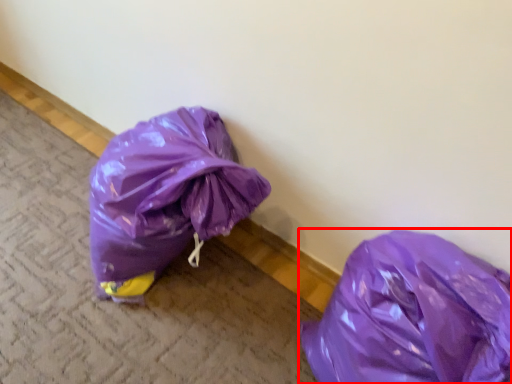
Question: Considering the relative positions of plastic bag (annotated by the red box) and pavement in the image provided, where is plastic bag (annotated by the red box) located with respect to the staircase?

Choices:
 (A) right
 (B) left

Answer: (A)